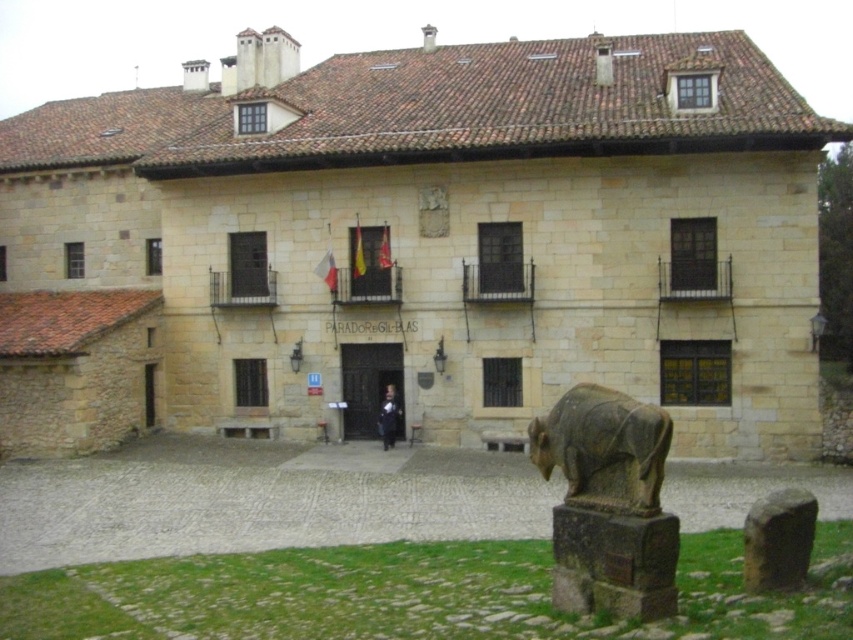
Question: Is gray stone bear at lower right to the left of dark blue fabric coat at center from the viewer's perspective?

Choices:
 (A) yes
 (B) no

Answer: (B)

Question: Is gray stone bear at lower right wider than dark blue fabric coat at center?

Choices:
 (A) yes
 (B) no

Answer: (A)

Question: Which point is farther from the camera taking this photo?

Choices:
 (A) (671, 611)
 (B) (393, 397)

Answer: (B)

Question: From the image, what is the correct spatial relationship of gray stone bear at lower right in relation to dark blue fabric coat at center?

Choices:
 (A) right
 (B) left

Answer: (A)

Question: Which of the following is the closest to the observer?

Choices:
 (A) gray stone bear at lower right
 (B) dark blue fabric coat at center

Answer: (A)